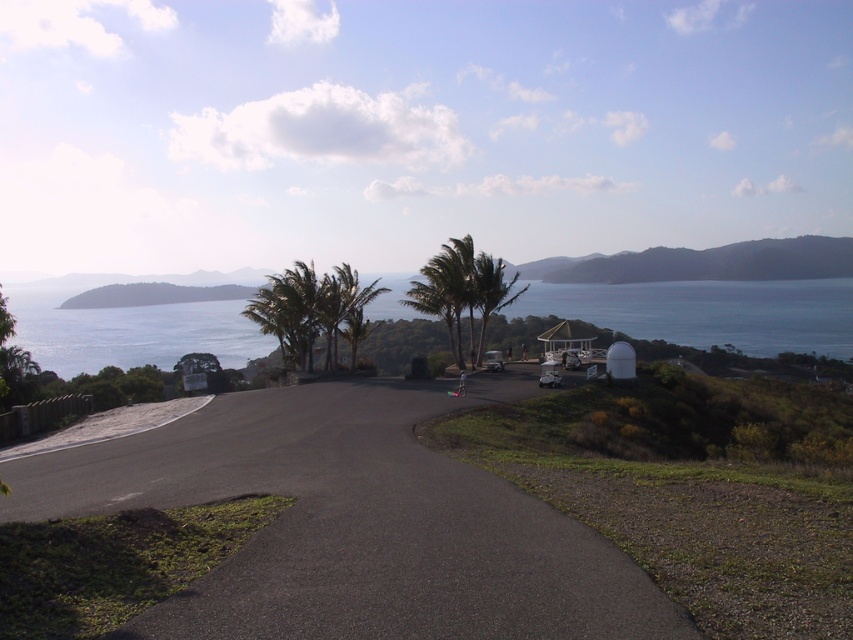
Looking at this image, is black asphalt road at center to the left of blue water at center from the viewer's perspective?

No, black asphalt road at center is not to the left of blue water at center.

Which is more to the left, black asphalt road at center or blue water at center?

From the viewer's perspective, blue water at center appears more on the left side.

Is point (677, 634) closer to viewer compared to point (109, 324)?

Yes.

Identify the location of black asphalt road at center. (354, 524).

Does black asphalt road at center appear on the left side of green leafy palm tree at center?

Indeed, black asphalt road at center is positioned on the left side of green leafy palm tree at center.

Is black asphalt road at center bigger than green leafy palm tree at center?

Actually, black asphalt road at center might be smaller than green leafy palm tree at center.

Where is `black asphalt road at center`? black asphalt road at center is located at coordinates (354, 524).

Is blue water at center smaller than green leafy palm trees at center?

Incorrect, blue water at center is not smaller in size than green leafy palm trees at center.

How far apart are blue water at center and green leafy palm trees at center?

blue water at center and green leafy palm trees at center are 173.94 meters apart from each other.

Locate an element on the screen. blue water at center is located at coordinates (711, 312).